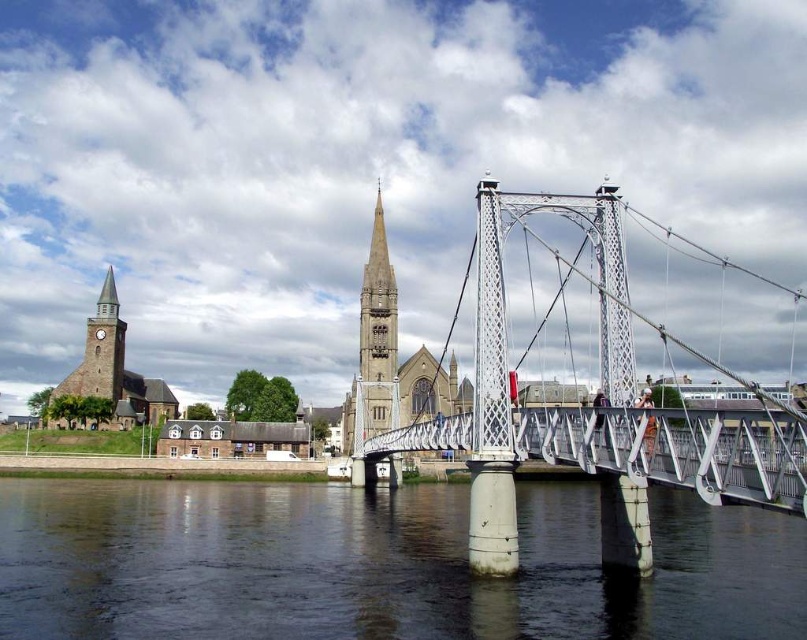
Based on the scene description, what are the coordinates of the white metallic pedestrian bridge at center?

The coordinates of the white metallic pedestrian bridge at center are at point [674,449].

You are a painter setting up an easel to paint the white metallic pedestrian bridge at center and the light gray stone spire at center. You want to ensure your painting accurately reflects their sizes. Based on the scene, which object should you draw wider in your artwork?

The white metallic pedestrian bridge at center should be drawn wider in the artwork since its width is larger than the light gray stone spire at center.